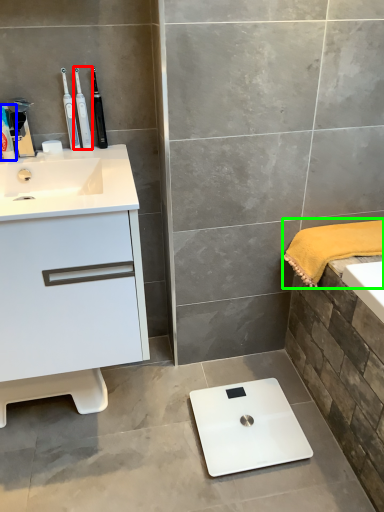
Question: Which is nearer to the toothbrush (highlighted by a red box)? toiletry (highlighted by a blue box) or bath towel (highlighted by a green box).

Choices:
 (A) toiletry
 (B) bath towel

Answer: (A)